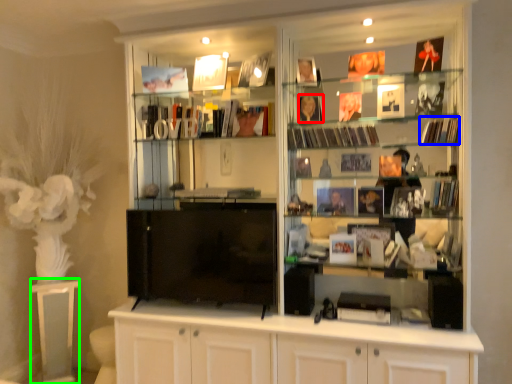
Question: Considering the real-world distances, which object is farthest from book (highlighted by a red box)? magazine (highlighted by a blue box) or table (highlighted by a green box)?

Choices:
 (A) magazine
 (B) table

Answer: (B)